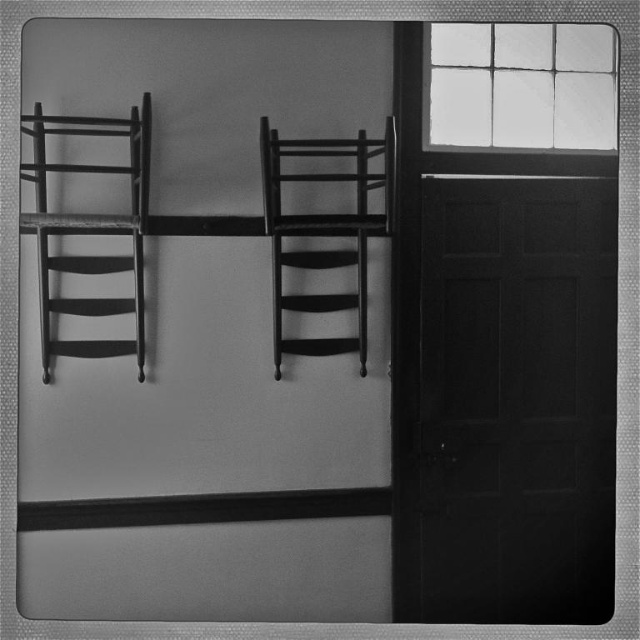
Question: Which object is the closest to the smooth black door at right?

Choices:
 (A) wooden chair at left
 (B) smooth dark wood chair at center

Answer: (B)

Question: Estimate the real-world distances between objects in this image. Which object is farther from the smooth black door at right?

Choices:
 (A) glass paneled window at upper right
 (B) smooth dark wood chair at center

Answer: (B)

Question: Does smooth black door at right lie in front of wooden chair at left?

Choices:
 (A) no
 (B) yes

Answer: (A)

Question: Can you confirm if glass paneled window at upper right is smaller than wooden chair at left?

Choices:
 (A) no
 (B) yes

Answer: (B)

Question: Does smooth black door at right appear on the right side of smooth dark wood chair at center?

Choices:
 (A) no
 (B) yes

Answer: (B)

Question: Which object appears closest to the camera in this image?

Choices:
 (A) glass paneled window at upper right
 (B) wooden chair at left
 (C) smooth dark wood chair at center

Answer: (B)